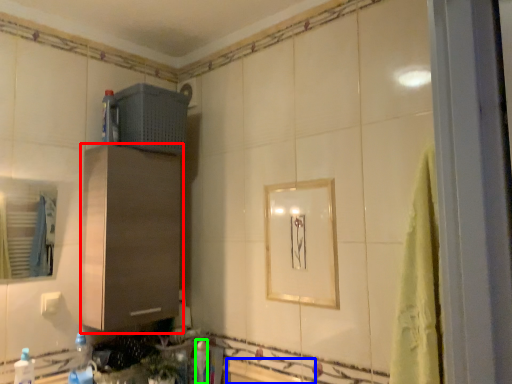
Question: Which object is positioned farthest from cabinetry (highlighted by a red box)? Select from bath (highlighted by a blue box) and bottle (highlighted by a green box).

Choices:
 (A) bath
 (B) bottle

Answer: (A)